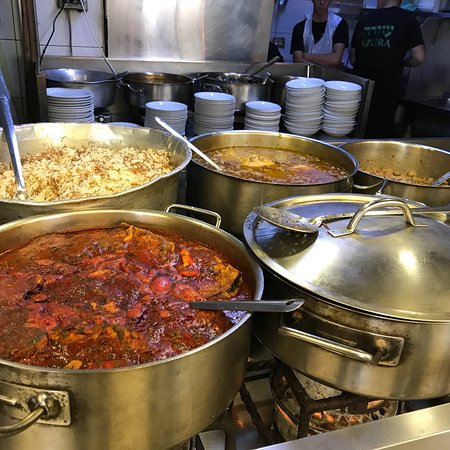
At what (x,y) coordinates should I click in order to perform the action: click on back wall. Please return your answer as a coordinate pair (x, y). Looking at the image, I should click on (98, 23), (295, 10).